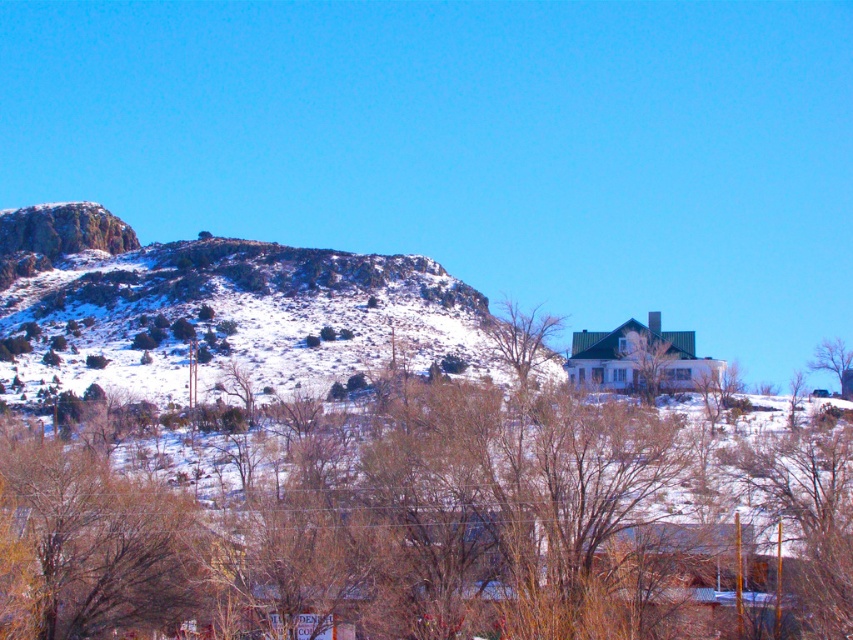
Question: Can you confirm if green matte house at center is thinner than bare branches at upper right?

Choices:
 (A) yes
 (B) no

Answer: (A)

Question: Does brown leafless tree at center have a lesser width compared to green matte house at center?

Choices:
 (A) no
 (B) yes

Answer: (A)

Question: Which is nearer to the green matte house at center?

Choices:
 (A) bare branches at upper right
 (B) brown leafless tree at center

Answer: (A)

Question: Which is nearer to the bare branches at upper right?

Choices:
 (A) green matte house at center
 (B) brown leafless tree at center

Answer: (A)

Question: Can you confirm if brown leafless tree at center is bigger than bare branches at upper right?

Choices:
 (A) yes
 (B) no

Answer: (A)

Question: Which of the following is the closest to the observer?

Choices:
 (A) (653, 400)
 (B) (248, 444)

Answer: (B)